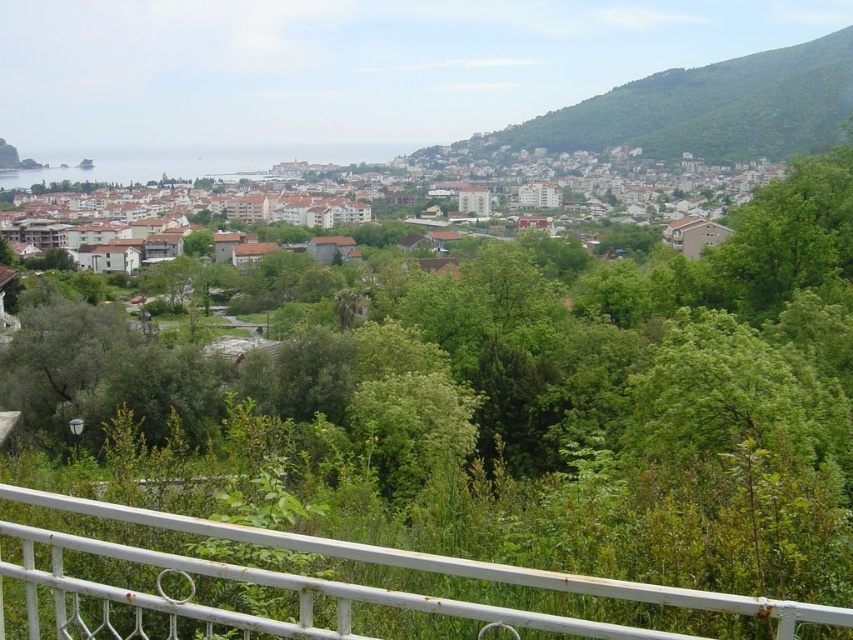
You are standing at the viewpoint and want to take a photo of the white matte buildings at center without the white metal railing at lower center blocking the view. Is it possible to do so by moving your position forward or backward?

The white metal railing at lower center is positioned under the white matte buildings at center, meaning the railing is closer to the viewer. Moving backward would increase the distance between you and the railing, potentially allowing the buildings to be framed without obstruction. Moving forward might bring the railing closer, worsening the obstruction. Therefore, moving backward is advisable to capture the buildings without the railing blocking the view.

You are standing at the viewpoint and want to know the distance between the white metal railing at lower center and the white matte buildings at center. Can you estimate how far apart they are?

The white metal railing at lower center and the white matte buildings at center are 336.47 meters apart from each other.